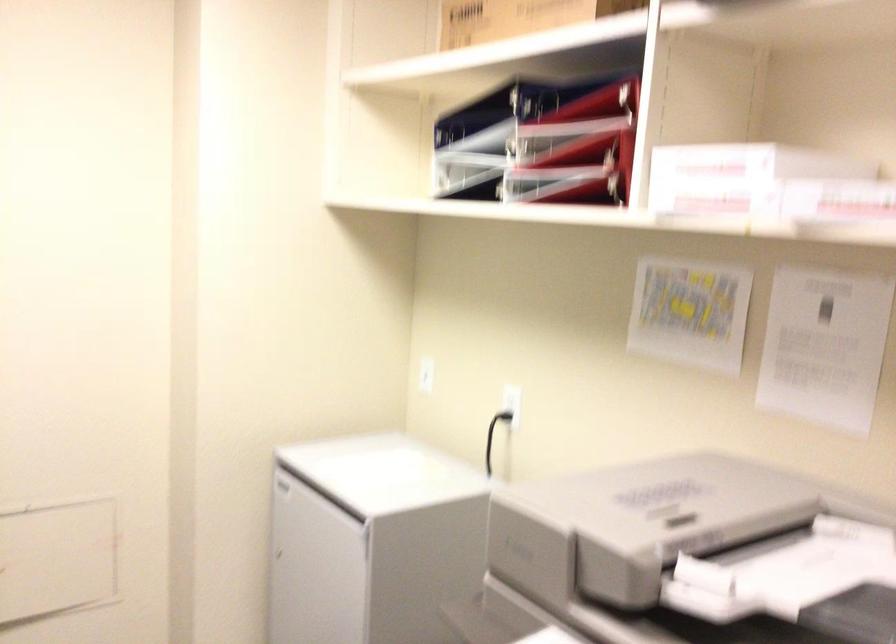
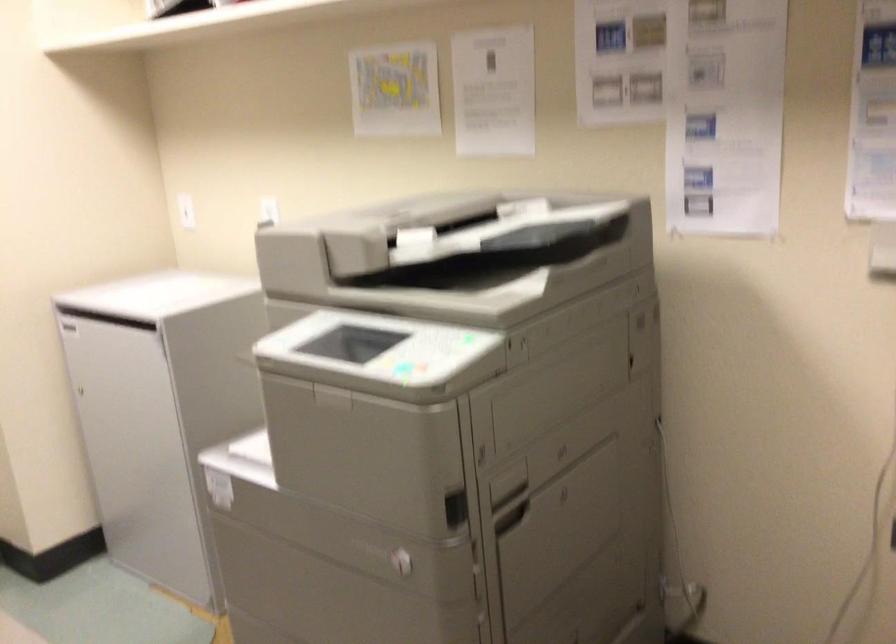
Question: I am providing you with two images of the same scene from different viewpoints. Please identify which objects are invisible in image2.

Choices:
 (A) light blue mug handle
 (B) printer scanner lid
 (C) printer panel handle
 (D) black electrical plug

Answer: (D)